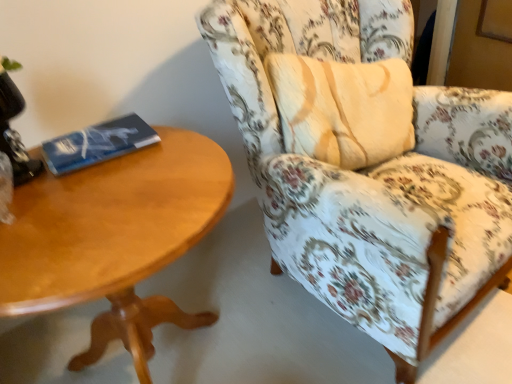
I want to click on empty space that is ontop of blue matte paperback book at left (from a real-world perspective), so click(88, 134).